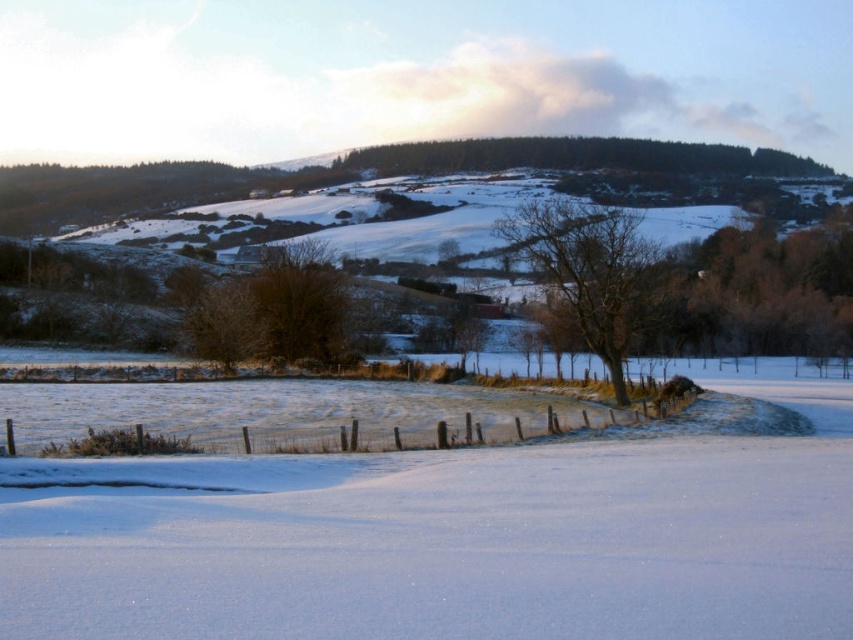
Can you confirm if white powdery snow at center is shorter than wooden fence at center?

No.

Who is positioned more to the right, white powdery snow at center or wooden fence at center?

white powdery snow at center is more to the right.

Image resolution: width=853 pixels, height=640 pixels. What do you see at coordinates (460, 540) in the screenshot? I see `white powdery snow at center` at bounding box center [460, 540].

The height and width of the screenshot is (640, 853). Identify the location of white powdery snow at center. (460, 540).

Can you confirm if bare wood tree at center is positioned below wooden fence at center?

Actually, bare wood tree at center is above wooden fence at center.

Is point (633, 304) positioned in front of point (389, 432)?

No, it is behind (389, 432).

Find the location of a particular element. bare wood tree at center is located at coordinates (593, 272).

Between white powdery snow at center and bare wood tree at center, which one has more height?

bare wood tree at center

Can you confirm if white powdery snow at center is thinner than bare wood tree at center?

In fact, white powdery snow at center might be wider than bare wood tree at center.

Which is in front, point (808, 404) or point (648, 280)?

Point (808, 404)

Identify the location of white powdery snow at center. The height and width of the screenshot is (640, 853). (460, 540).